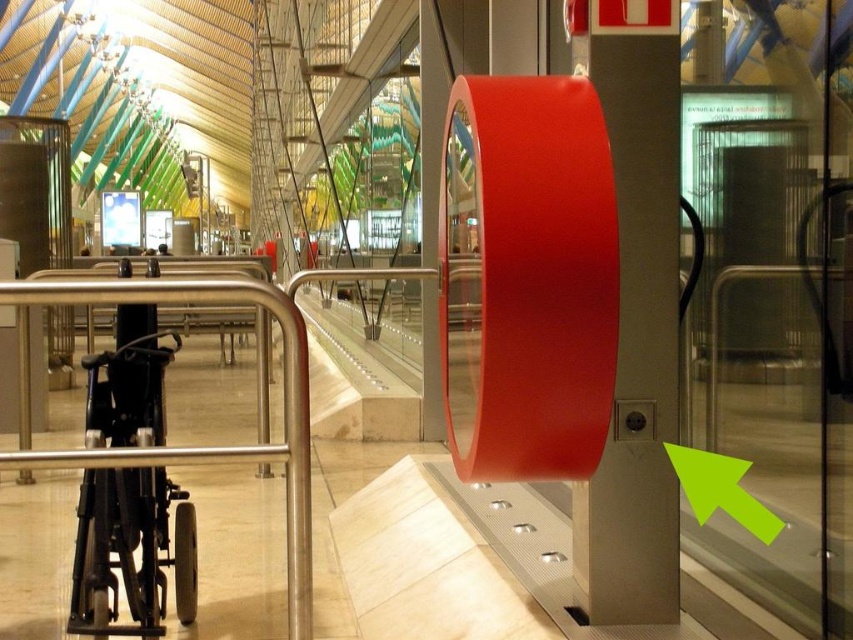
Does black plastic wheelchair at left appear over satin silver rail at center?

No.

The height and width of the screenshot is (640, 853). What do you see at coordinates (131, 552) in the screenshot? I see `black plastic wheelchair at left` at bounding box center [131, 552].

I want to click on black plastic wheelchair at left, so click(x=131, y=552).

Who is lower down, red matte/finish pillar at center or satin silver rail at center?

Positioned lower is satin silver rail at center.

Looking at this image, between red matte/finish pillar at center and satin silver rail at center, which one has less height?

Standing shorter between the two is satin silver rail at center.

Is point (643, 26) more distant than point (154, 298)?

Yes, it is.

I want to click on red matte/finish pillar at center, so click(635, 316).

Which is below, red matte/finish pillar at center or green matte arrow at lower left?

green matte arrow at lower left

Is red matte/finish pillar at center smaller than green matte arrow at lower left?

No.

Is point (654, 328) behind point (766, 512)?

Yes, point (654, 328) is behind point (766, 512).

Identify the location of red matte/finish pillar at center. The image size is (853, 640). (635, 316).